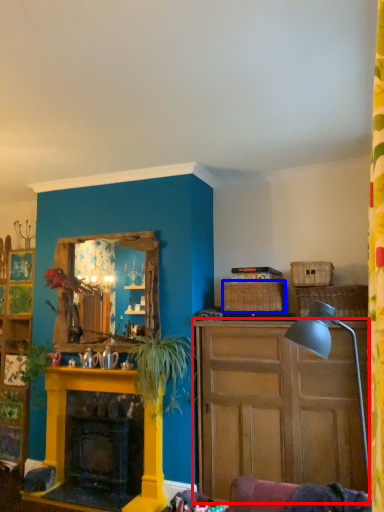
Question: Which object is further to the camera taking this photo, cabinet (highlighted by a red box) or picnic basket (highlighted by a blue box)?

Choices:
 (A) cabinet
 (B) picnic basket

Answer: (B)